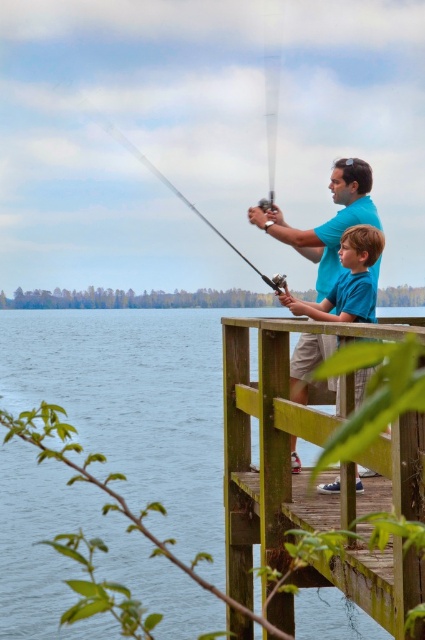
You are standing on the wooden dock at center and want to cast your shiny metallic fishing pole at center into the water. Can you extend the fishing pole fully without it touching the dock?

The wooden dock at center is shorter than the shiny metallic fishing pole at center, so extending the fishing pole fully might cause it to hit the dock since the dock is not long enough to accommodate the pole.